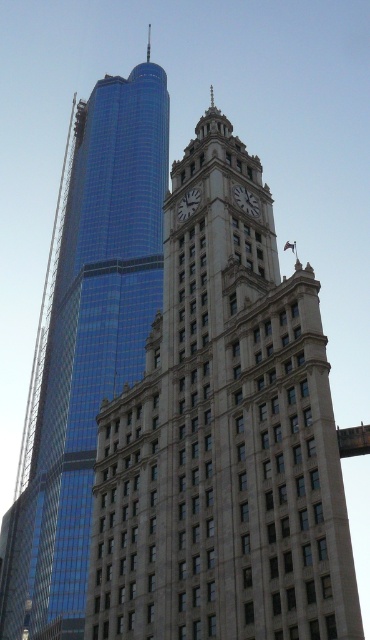
Question: Is shiny glass skyscraper at left to the left of silver metallic clock at upper center from the viewer's perspective?

Choices:
 (A) no
 (B) yes

Answer: (B)

Question: Can you confirm if shiny glass skyscraper at left is positioned to the left of silver metallic clock at center?

Choices:
 (A) yes
 (B) no

Answer: (A)

Question: Which point is closer to the camera taking this photo?

Choices:
 (A) (179, 561)
 (B) (256, 218)

Answer: (A)

Question: Does silver metallic clock at upper center lie behind silver metallic clock at center?

Choices:
 (A) no
 (B) yes

Answer: (A)

Question: Which point appears closest to the camera in this image?

Choices:
 (A) (257, 211)
 (B) (190, 209)
 (C) (163, 621)

Answer: (C)

Question: Which object is positioned farthest from the shiny glass skyscraper at left?

Choices:
 (A) silver metallic clock at center
 (B) beige stone clock tower at center
 (C) silver metallic clock at upper center

Answer: (C)